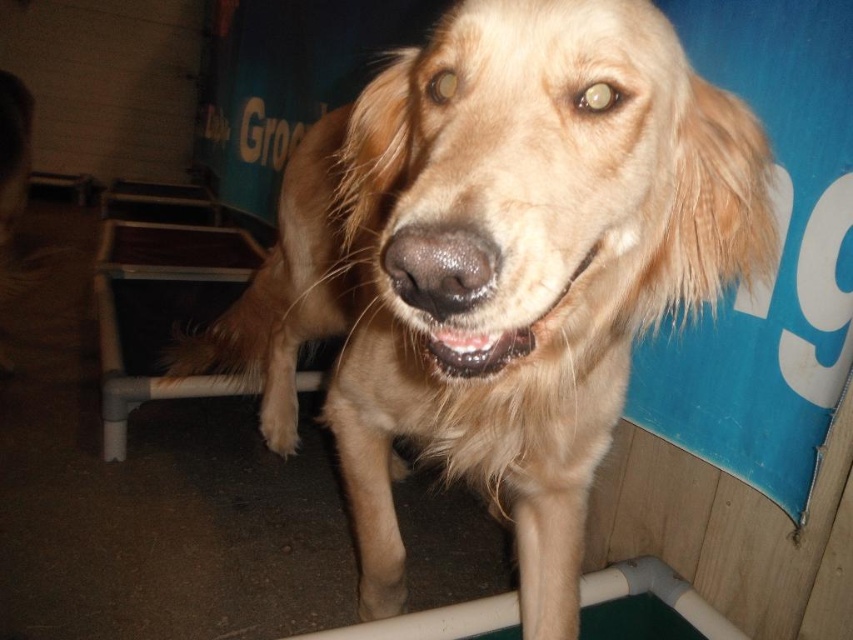
You are a photographer trying to capture the golden fur dog at center and the shiny brown teeth at center in a single shot. Based on their positions, which one is closer to the camera?

The golden fur dog at center is below the shiny brown teeth at center, so the shiny brown teeth at center is closer to the camera.

You are a veterinarian examining a dog. You notice the golden fur dog at center and the shiny brown teeth at center. Which object is larger in size?

The golden fur dog at center is bigger than the shiny brown teeth at center.

You are a photographer trying to capture the golden retriever in the image. The dog is standing at the center of the frame. You want to place a focus point at coordinate point (497,266). Will this point land on the dog?

Result: Yes, the point (497,266) is on the golden fur dog at center, so placing the focus point there will ensure the dog is in focus.